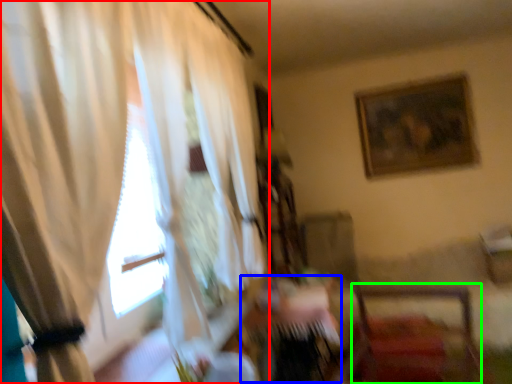
Question: Which object is the farthest from curtain (highlighted by a red box)? Choose among these: table (highlighted by a blue box) or chair (highlighted by a green box).

Choices:
 (A) table
 (B) chair

Answer: (B)